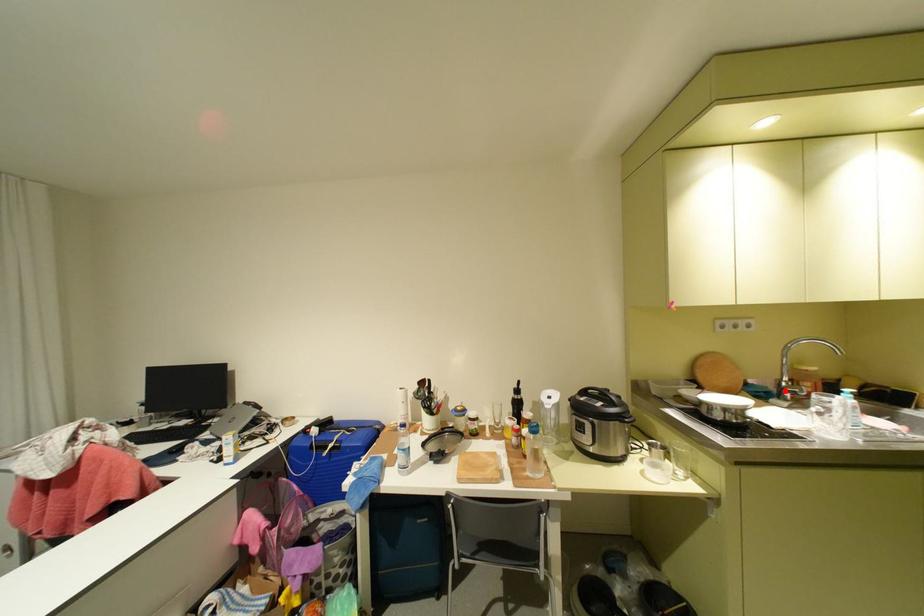
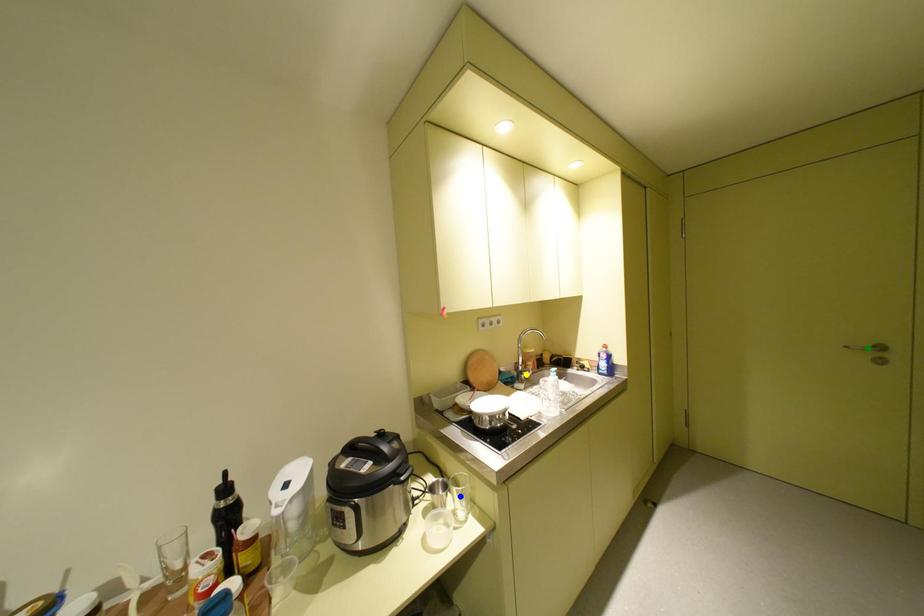
Question: I am providing you with two images of the same scene from different viewpoints. A red point is marked on the first image. You are given multiple points on the second image. Which point in image 2 represents the same 3d spot as the red point in image 1?

Choices:
 (A) yellow point
 (B) blue point
 (C) green point

Answer: (A)